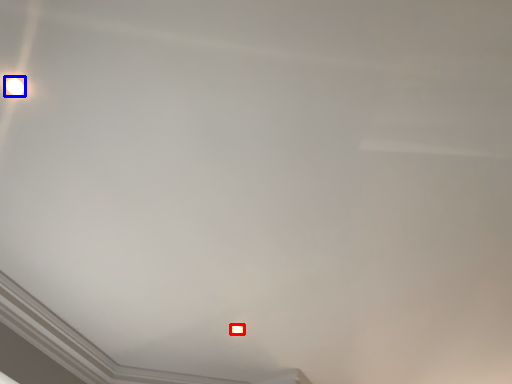
Question: Which object appears farthest to the camera in this image, lamp (highlighted by a red box) or lamp (highlighted by a blue box)?

Choices:
 (A) lamp
 (B) lamp

Answer: (A)